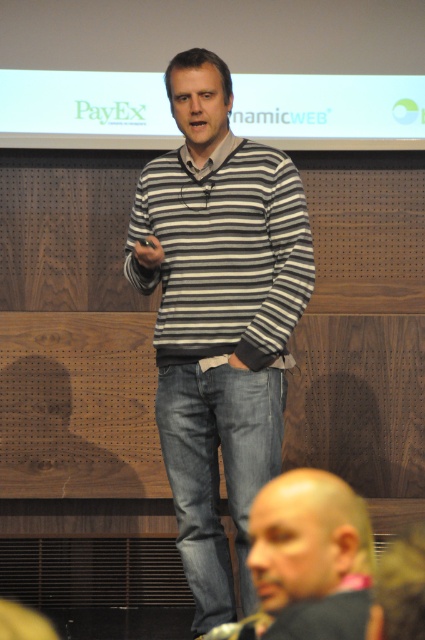
You are a photographer positioned at the back of the stage. You want to take a clear photo of both the striped cotton sweater at center and the bald head at lower right. Based on their distance, will both subjects be in focus if your camera has a depth of field that can cover 40 inches?

The striped cotton sweater at center is 37.83 inches away from the bald head at lower right. Since the distance between them is less than the camera depth of field of 40 inches, both subjects will be in focus.

You are an event organizer who needs to place a name tag on the stage. The name tag must be placed exactly at the center of the stage. Where should you place the name tag relative to the striped sweater at center?

The striped sweater at center is already positioned at the center of the stage, as its coordinates are at point (218, 317), which is nearly the exact center point of the stage. Therefore, the name tag should be placed directly at the position of the striped sweater at center.

You are a stagehand setting up a new light fixture. You need to place it at the point closer to the audience between point (226, 259) and point (257, 499). Which point should you choose?

Point (226, 259) is further to the viewer than point (257, 499). Therefore, the closer point to the audience would be point (257, 499), so you should place the light fixture there.